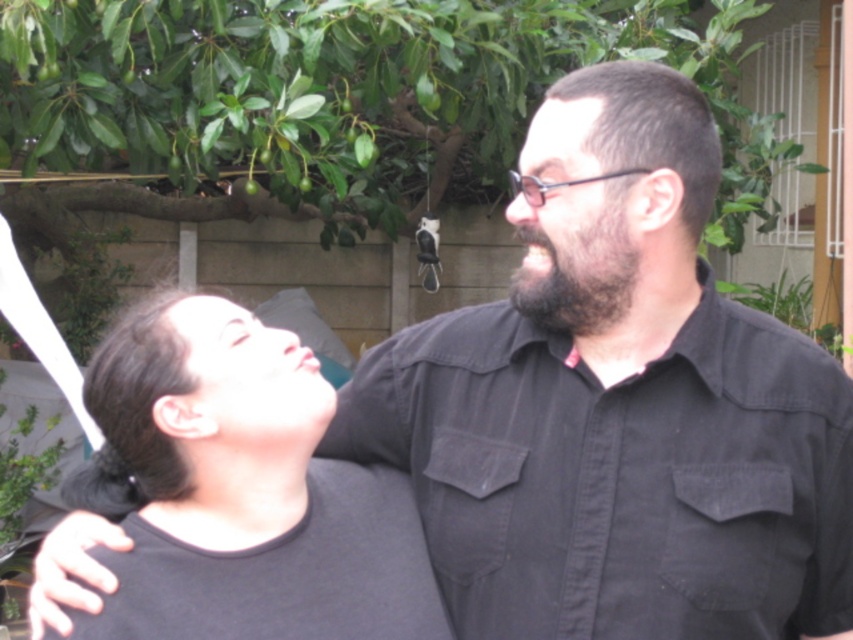
Between dark gray shirt at center and dark brown fuzzy beard at center, which one appears on the left side from the viewer's perspective?

dark gray shirt at center is more to the left.

Is point (213, 296) closer to viewer compared to point (552, 316)?

No.

Identify the location of dark gray shirt at center. The image size is (853, 640). (257, 500).

Does black cotton shirt at center have a greater width compared to dark brown fuzzy beard at center?

Indeed, black cotton shirt at center has a greater width compared to dark brown fuzzy beard at center.

Who is more distant from viewer, (445, 369) or (613, 278)?

Positioned behind is point (445, 369).

Where is `black cotton shirt at center`? Image resolution: width=853 pixels, height=640 pixels. black cotton shirt at center is located at coordinates (618, 476).

Is black cotton shirt at center below dark gray shirt at center?

Incorrect, black cotton shirt at center is not positioned below dark gray shirt at center.

Which is more to the left, black cotton shirt at center or dark gray shirt at center?

dark gray shirt at center is more to the left.

Find the location of a particular element. black cotton shirt at center is located at coordinates (618, 476).